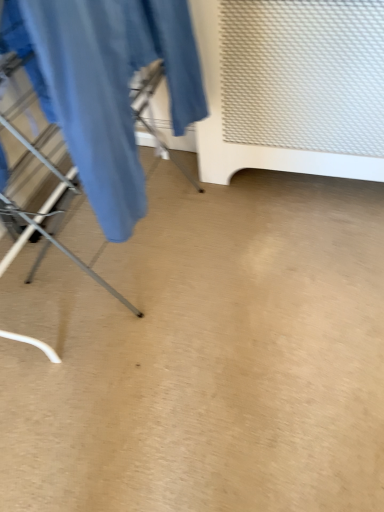
You are a GUI agent. You are given a task and a screenshot of the screen. Output one action in this format:
    pyautogui.click(x=<x>, y=<y>)
    Task: Click on the vacant space situated on the left part of white textured radiator at upper right
    
    Given the screenshot: What is the action you would take?
    [210, 212]